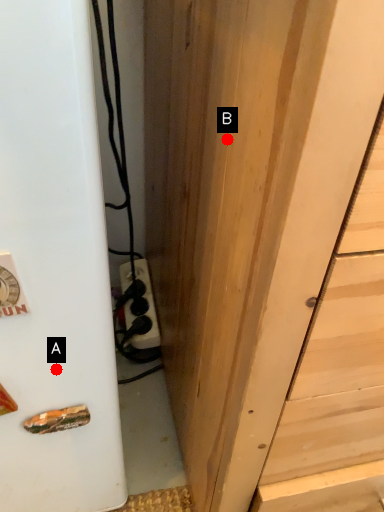
Question: Two points are circled on the image, labeled by A and B beside each circle. Which of the following is the closest to the observer?

Choices:
 (A) A is closer
 (B) B is closer

Answer: (B)